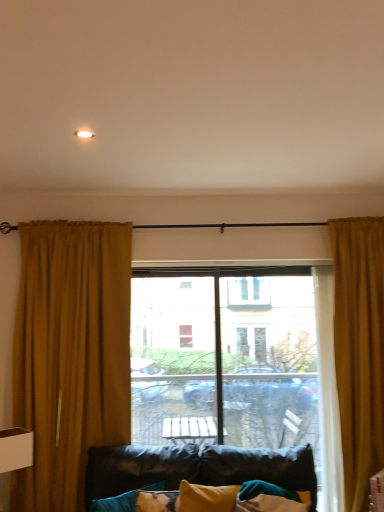
This screenshot has width=384, height=512. Find the location of `mustard velvet curtain at left, the 1th curtain when ordered from left to right`. mustard velvet curtain at left, the 1th curtain when ordered from left to right is located at coordinates (70, 355).

What are the coordinates of `golden textured curtain at right, which is the 2th curtain in left-to-right order` in the screenshot? It's located at (359, 350).

Measure the distance between golden textured curtain at right, which is the 2th curtain in left-to-right order, and camera.

golden textured curtain at right, which is the 2th curtain in left-to-right order, is 2.50 meters from camera.

The image size is (384, 512). I want to click on transparent glass window at center, so click(237, 365).

Is transparent glass window at center positioned with its back to velvet teal pillow at lower left?

No, transparent glass window at center is not facing away from velvet teal pillow at lower left.

I want to click on window that is above the velvet teal pillow at lower left (from the image's perspective), so click(237, 365).

Which object is wider, transparent glass window at center or velvet teal pillow at lower left?

velvet teal pillow at lower left.

Considering the sizes of mustard velvet curtain at left, placed as the second curtain when sorted from right to left, and transparent glass window at center in the image, is mustard velvet curtain at left, placed as the second curtain when sorted from right to left, wider or thinner than transparent glass window at center?

mustard velvet curtain at left, placed as the second curtain when sorted from right to left, is thinner than transparent glass window at center.

Is point (80, 318) closer or farther from the camera than point (214, 421)?

Point (80, 318) appears to be closer to the viewer than point (214, 421).

Is transparent glass window at center located within mustard velvet curtain at left, placed as the second curtain when sorted from right to left?

No, transparent glass window at center is not surrounded by mustard velvet curtain at left, placed as the second curtain when sorted from right to left.

Between mustard velvet curtain at left, placed as the second curtain when sorted from right to left, and transparent glass window at center, which one appears on the left side from the viewer's perspective?

Positioned to the left is mustard velvet curtain at left, placed as the second curtain when sorted from right to left.

Is mustard velvet curtain at left, placed as the second curtain when sorted from right to left, oriented away from velvet teal pillow at lower left?

→ No, mustard velvet curtain at left, placed as the second curtain when sorted from right to left, is not facing the opposite direction of velvet teal pillow at lower left.

Is velvet teal pillow at lower left completely or partially inside mustard velvet curtain at left, the 1th curtain when ordered from left to right?

Definitely not — velvet teal pillow at lower left is not inside mustard velvet curtain at left, the 1th curtain when ordered from left to right.

Consider the image. Considering the relative sizes of mustard velvet curtain at left, placed as the second curtain when sorted from right to left, and velvet teal pillow at lower left in the image provided, is mustard velvet curtain at left, placed as the second curtain when sorted from right to left, bigger than velvet teal pillow at lower left?

Yes, mustard velvet curtain at left, placed as the second curtain when sorted from right to left, is bigger than velvet teal pillow at lower left.

Considering the positions of objects golden textured curtain at right, which is the 2th curtain in left-to-right order, and transparent glass window at center in the image provided, who is more to the right, golden textured curtain at right, which is the 2th curtain in left-to-right order, or transparent glass window at center?

From the viewer's perspective, golden textured curtain at right, which is the 2th curtain in left-to-right order, appears more on the right side.

Considering the sizes of objects golden textured curtain at right, which appears as the 1th curtain when viewed from the right, and transparent glass window at center in the image provided, who is smaller, golden textured curtain at right, which appears as the 1th curtain when viewed from the right, or transparent glass window at center?

golden textured curtain at right, which appears as the 1th curtain when viewed from the right.

Is golden textured curtain at right, which is the 2th curtain in left-to-right order, aimed at transparent glass window at center?

No, golden textured curtain at right, which is the 2th curtain in left-to-right order, does not turn towards transparent glass window at center.

From a real-world perspective, between mustard velvet curtain at left, placed as the second curtain when sorted from right to left, and golden textured curtain at right, which appears as the 1th curtain when viewed from the right, who is vertically higher?

mustard velvet curtain at left, placed as the second curtain when sorted from right to left.

Between mustard velvet curtain at left, the 1th curtain when ordered from left to right, and golden textured curtain at right, which appears as the 1th curtain when viewed from the right, which one appears on the right side from the viewer's perspective?

golden textured curtain at right, which appears as the 1th curtain when viewed from the right.

Between mustard velvet curtain at left, the 1th curtain when ordered from left to right, and golden textured curtain at right, which is the 2th curtain in left-to-right order, which one has larger width?

golden textured curtain at right, which is the 2th curtain in left-to-right order, is wider.

From the image's perspective, is mustard velvet curtain at left, the 1th curtain when ordered from left to right, beneath golden textured curtain at right, which appears as the 1th curtain when viewed from the right?

No.

What's the angular difference between golden textured curtain at right, which appears as the 1th curtain when viewed from the right, and mustard velvet curtain at left, the 1th curtain when ordered from left to right,'s facing directions?

0.00127 degrees.

Looking at the image, does golden textured curtain at right, which appears as the 1th curtain when viewed from the right, seem bigger or smaller compared to mustard velvet curtain at left, the 1th curtain when ordered from left to right?

In the image, golden textured curtain at right, which appears as the 1th curtain when viewed from the right, appears to be larger than mustard velvet curtain at left, the 1th curtain when ordered from left to right.

Which of these two, golden textured curtain at right, which is the 2th curtain in left-to-right order, or mustard velvet curtain at left, placed as the second curtain when sorted from right to left, stands taller?

Answer: golden textured curtain at right, which is the 2th curtain in left-to-right order, is taller.

Is golden textured curtain at right, which is the 2th curtain in left-to-right order, at the left side of mustard velvet curtain at left, placed as the second curtain when sorted from right to left?

Incorrect, golden textured curtain at right, which is the 2th curtain in left-to-right order, is not on the left side of mustard velvet curtain at left, placed as the second curtain when sorted from right to left.

Considering the positions of point (94, 505) and point (78, 276), is point (94, 505) closer or farther from the camera than point (78, 276)?

Point (94, 505) is closer to the camera than point (78, 276).

This screenshot has width=384, height=512. Identify the location of pillow located below the mustard velvet curtain at left, placed as the second curtain when sorted from right to left (from the image's perspective). (123, 500).

Is velvet teal pillow at lower left bigger than mustard velvet curtain at left, the 1th curtain when ordered from left to right?

No, velvet teal pillow at lower left is not bigger than mustard velvet curtain at left, the 1th curtain when ordered from left to right.

Find the location of `pillow lying below the transparent glass window at center (from the image's perspective)`. pillow lying below the transparent glass window at center (from the image's perspective) is located at coordinates (123, 500).

Locate an element on the screen. the 2nd curtain located above the transparent glass window at center (from a real-world perspective) is located at coordinates (70, 355).

From the image, which object appears to be nearer to golden textured curtain at right, which is the 2th curtain in left-to-right order, velvet teal pillow at lower left or mustard velvet curtain at left, the 1th curtain when ordered from left to right?

Among the two, velvet teal pillow at lower left is located nearer to golden textured curtain at right, which is the 2th curtain in left-to-right order.

When comparing their distances from golden textured curtain at right, which is the 2th curtain in left-to-right order, does velvet teal pillow at lower left or transparent glass window at center seem further?

velvet teal pillow at lower left lies further to golden textured curtain at right, which is the 2th curtain in left-to-right order, than the other object.

Based on their spatial positions, is transparent glass window at center or mustard velvet curtain at left, placed as the second curtain when sorted from right to left, closer to velvet teal pillow at lower left?

Based on the image, mustard velvet curtain at left, placed as the second curtain when sorted from right to left, appears to be nearer to velvet teal pillow at lower left.

Which object lies further to the anchor point transparent glass window at center, golden textured curtain at right, which appears as the 1th curtain when viewed from the right, or mustard velvet curtain at left, the 1th curtain when ordered from left to right?

mustard velvet curtain at left, the 1th curtain when ordered from left to right, is positioned further to the anchor transparent glass window at center.

When comparing their distances from transparent glass window at center, does mustard velvet curtain at left, placed as the second curtain when sorted from right to left, or golden textured curtain at right, which appears as the 1th curtain when viewed from the right, seem further?

mustard velvet curtain at left, placed as the second curtain when sorted from right to left, is further to transparent glass window at center.

Estimate the real-world distances between objects in this image. Which object is further from velvet teal pillow at lower left, golden textured curtain at right, which is the 2th curtain in left-to-right order, or transparent glass window at center?

The object further to velvet teal pillow at lower left is golden textured curtain at right, which is the 2th curtain in left-to-right order.

From the image, which object appears to be nearer to mustard velvet curtain at left, the 1th curtain when ordered from left to right, golden textured curtain at right, which appears as the 1th curtain when viewed from the right, or velvet teal pillow at lower left?

The object closer to mustard velvet curtain at left, the 1th curtain when ordered from left to right, is velvet teal pillow at lower left.

From the image, which object appears to be nearer to mustard velvet curtain at left, the 1th curtain when ordered from left to right, transparent glass window at center or golden textured curtain at right, which appears as the 1th curtain when viewed from the right?

Among the two, transparent glass window at center is located nearer to mustard velvet curtain at left, the 1th curtain when ordered from left to right.

At what (x,y) coordinates should I click in order to perform the action: click on window between velvet teal pillow at lower left and golden textured curtain at right, which is the 2th curtain in left-to-right order, in the horizontal direction. Please return your answer as a coordinate pair (x, y). Looking at the image, I should click on point(237,365).

Locate an element on the screen. The image size is (384, 512). pillow located between mustard velvet curtain at left, the 1th curtain when ordered from left to right, and transparent glass window at center in the left-right direction is located at coordinates (123, 500).

This screenshot has height=512, width=384. I want to click on pillow situated between mustard velvet curtain at left, placed as the second curtain when sorted from right to left, and golden textured curtain at right, which appears as the 1th curtain when viewed from the right, from left to right, so click(x=123, y=500).

Locate an element on the screen. The image size is (384, 512). window between mustard velvet curtain at left, placed as the second curtain when sorted from right to left, and golden textured curtain at right, which is the 2th curtain in left-to-right order is located at coordinates (237, 365).